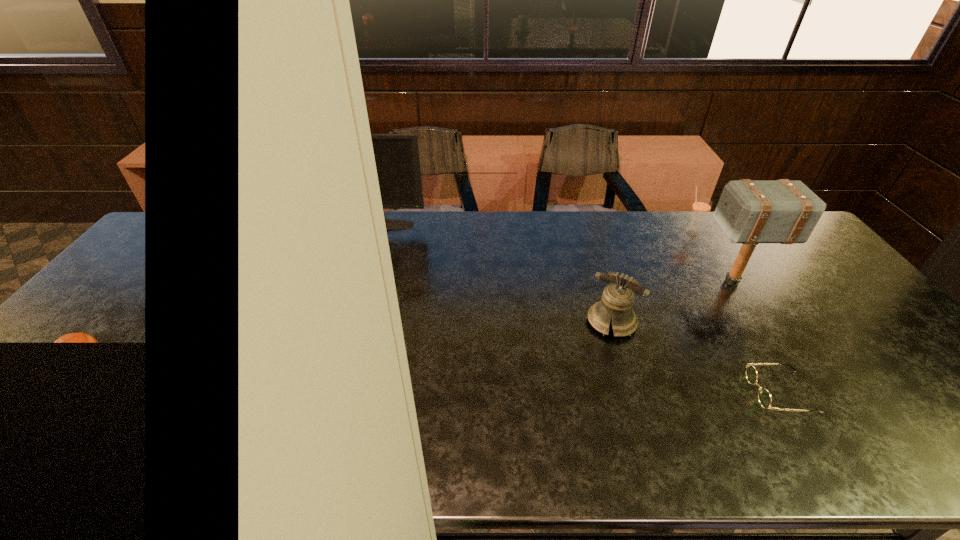
Image resolution: width=960 pixels, height=540 pixels. In order to click on free location located on the striking surface of the third farthest object in this screenshot , I will do `click(588, 282)`.

Find the location of `free space located on the left of the straw`. free space located on the left of the straw is located at coordinates (644, 233).

The image size is (960, 540). Identify the location of free spot located 0.220m on the back of the fourth object from right to left. (591, 257).

Where is `vacant space located 0.140m on the lenses of the spectacles`? The image size is (960, 540). vacant space located 0.140m on the lenses of the spectacles is located at coordinates (692, 392).

You are a GUI agent. You are given a task and a screenshot of the screen. Output one action in this format:
    pyautogui.click(x=<x>, y=<y>)
    Task: Click on the free location located 0.250m on the lenses of the spectacles
    The image size is (960, 540).
    Given the screenshot: What is the action you would take?
    pyautogui.click(x=645, y=392)

This screenshot has width=960, height=540. Identify the location of free space located 0.280m on the lenses of the spectacles. (633, 392).

Image resolution: width=960 pixels, height=540 pixels. Find the location of `monitor situated at the far edge`. monitor situated at the far edge is located at coordinates (397, 159).

Find the location of a particular element. straw located at the far edge is located at coordinates (701, 207).

Find the location of a particular element. vacant region at the far edge of the desktop is located at coordinates (444, 243).

In the image, there is a desktop. Where is `blank space at the near edge`? The width and height of the screenshot is (960, 540). blank space at the near edge is located at coordinates tap(342, 442).